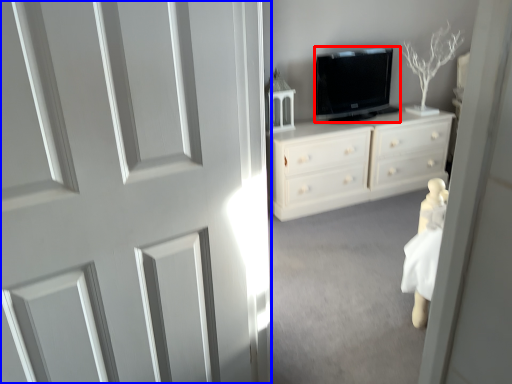
Question: Among these objects, which one is nearest to the camera, television (highlighted by a red box) or door (highlighted by a blue box)?

Choices:
 (A) television
 (B) door

Answer: (B)